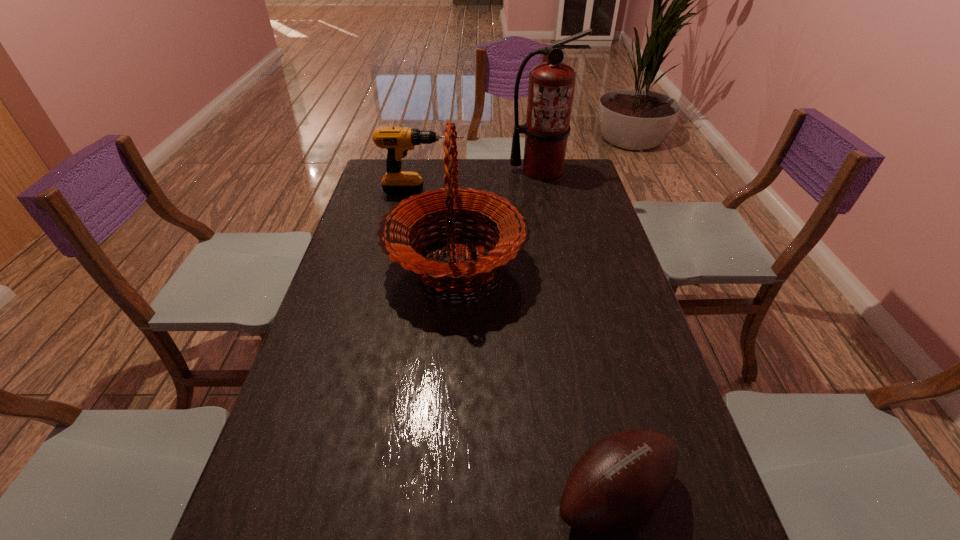
At what (x,y) coordinates should I click in order to perform the action: click on drill that is at the far edge. Please return your answer as a coordinate pair (x, y). The height and width of the screenshot is (540, 960). Looking at the image, I should click on (398, 141).

Find the location of a particular element. basket situated at the left edge is located at coordinates click(x=510, y=227).

Find the location of a particular element. The width and height of the screenshot is (960, 540). drill at the left edge is located at coordinates (398, 141).

At what (x,y) coordinates should I click in order to perform the action: click on object that is at the right edge. Please return your answer as a coordinate pair (x, y). Looking at the image, I should click on (551, 84).

Image resolution: width=960 pixels, height=540 pixels. I want to click on object located in the far left corner section of the desktop, so click(x=398, y=141).

I want to click on object positioned at the far right corner, so click(551, 84).

Where is `vacant space at the far edge`? vacant space at the far edge is located at coordinates click(502, 160).

In the image, there is a desktop. Where is `vacant space at the left edge`? This screenshot has width=960, height=540. vacant space at the left edge is located at coordinates (331, 294).

This screenshot has height=540, width=960. Find the location of `free region at the right edge of the desktop`. free region at the right edge of the desktop is located at coordinates (593, 249).

At what (x,y) coordinates should I click in order to perform the action: click on empty location between the tallest object and the drill. Please return your answer as a coordinate pair (x, y). Looking at the image, I should click on (482, 181).